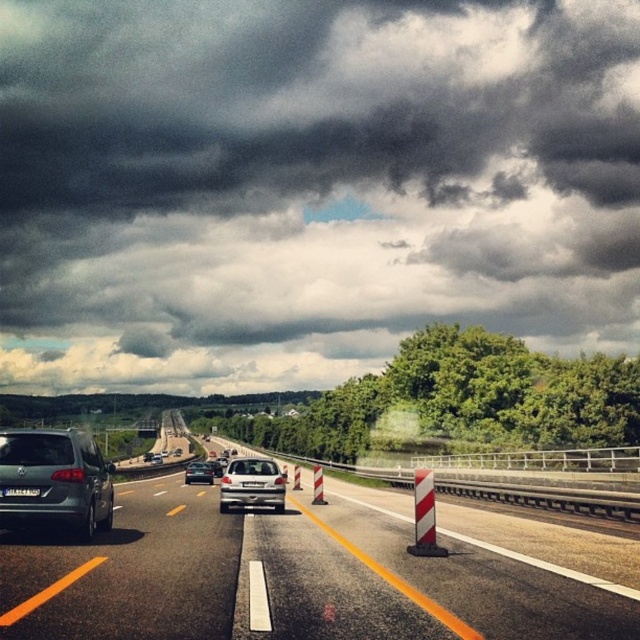
Can you confirm if dark gray cloud at upper center is taller than satin silver sedan at center?

Indeed, dark gray cloud at upper center has a greater height compared to satin silver sedan at center.

Is the position of dark gray cloud at upper center less distant than that of satin silver sedan at center?

No, dark gray cloud at upper center is behind satin silver sedan at center.

Is point (285, 323) closer to camera compared to point (209, 465)?

That is False.

Locate an element on the screen. This screenshot has height=640, width=640. dark gray cloud at upper center is located at coordinates (308, 182).

Who is positioned more to the left, dark gray cloud at upper center or metallic silver car at center?

Positioned to the left is dark gray cloud at upper center.

Locate an element on the screen. This screenshot has height=640, width=640. dark gray cloud at upper center is located at coordinates (308, 182).

Image resolution: width=640 pixels, height=640 pixels. What do you see at coordinates (308, 182) in the screenshot?
I see `dark gray cloud at upper center` at bounding box center [308, 182].

Image resolution: width=640 pixels, height=640 pixels. Find the location of `dark gray cloud at upper center`. dark gray cloud at upper center is located at coordinates (308, 182).

Who is positioned more to the left, satin silver van at center-left or satin silver sedan at center?

satin silver sedan at center

In the scene shown: Is satin silver van at center-left thinner than satin silver sedan at center?

Indeed, satin silver van at center-left has a lesser width compared to satin silver sedan at center.

You are a GUI agent. You are given a task and a screenshot of the screen. Output one action in this format:
    pyautogui.click(x=<x>, y=<y>)
    Task: Click on the satin silver van at center-left
    The width and height of the screenshot is (640, 640).
    Given the screenshot: What is the action you would take?
    tap(54, 481)